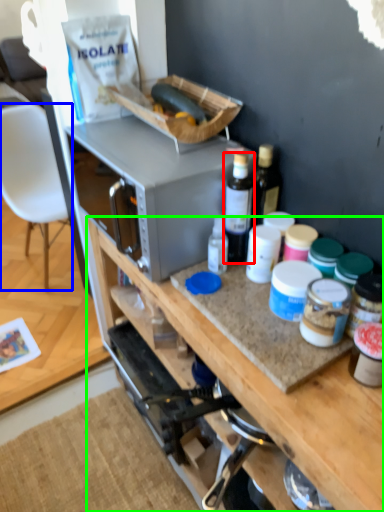
Question: Considering the real-world distances, which object is farthest from bottle (highlighted by a red box)? chair (highlighted by a blue box) or cabinetry (highlighted by a green box)?

Choices:
 (A) chair
 (B) cabinetry

Answer: (A)